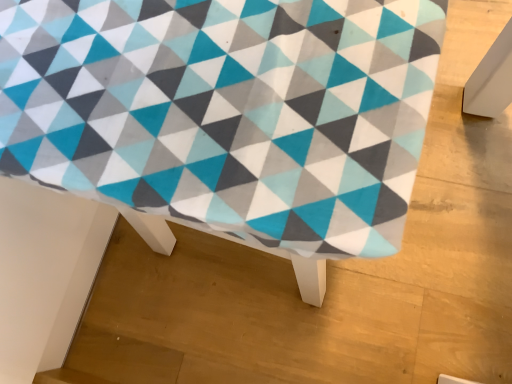
What do you see at coordinates (226, 116) in the screenshot?
I see `matte fabric stool at center` at bounding box center [226, 116].

Identify the location of matte fabric stool at center. The width and height of the screenshot is (512, 384). (226, 116).

Consider the image. Measure the distance between point (x=424, y=69) and camera.

A distance of 10.04 inches exists between point (x=424, y=69) and camera.

This screenshot has height=384, width=512. I want to click on matte fabric stool at center, so click(x=226, y=116).